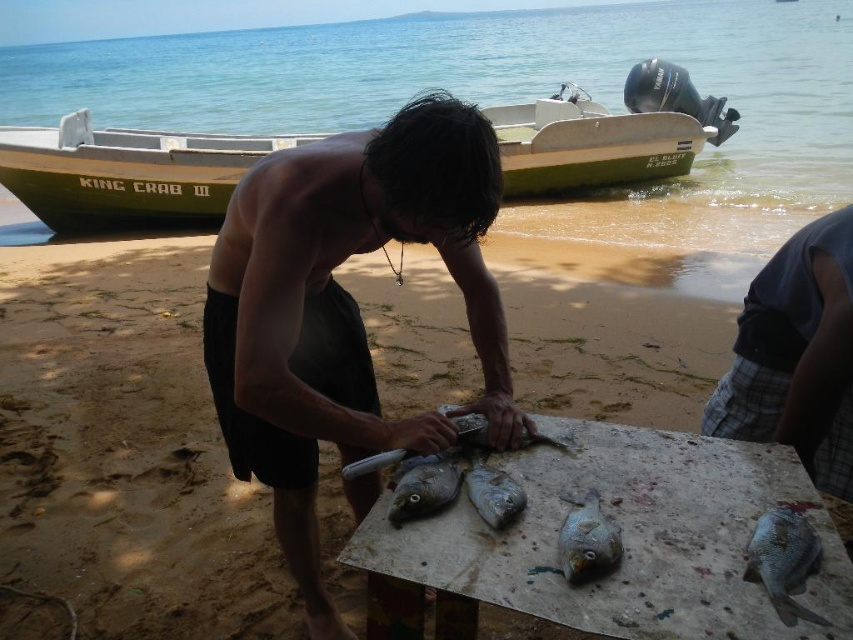
In the scene shown: How far apart are sandy beach at center and shiny silver fish at lower right?

8.33 feet

Is point (123, 353) farther from camera compared to point (756, 552)?

Yes, point (123, 353) is behind point (756, 552).

I want to click on sandy beach at center, so click(x=125, y=445).

Is point (520, 186) in front of point (810, 273)?

No, (520, 186) is behind (810, 273).

Where is `green matte boat at upper center`? green matte boat at upper center is located at coordinates (126, 172).

In order to click on green matte boat at upper center in this screenshot , I will do pyautogui.click(x=126, y=172).

Does white worn wood table at center lie in front of shiny silver fish at lower right?

Yes.

Is white worn wood table at center positioned behind shiny silver fish at lower right?

No, it is not.

Which is behind, point (593, 460) or point (770, 582)?

Positioned behind is point (593, 460).

Where is `white worn wood table at center`? This screenshot has height=640, width=853. white worn wood table at center is located at coordinates (622, 538).